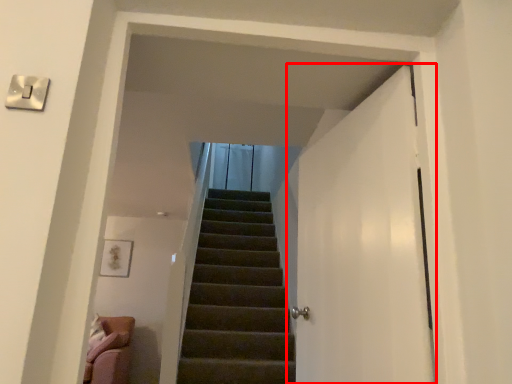
Question: In this image, where is door (annotated by the red box) located relative to electric outlet?

Choices:
 (A) right
 (B) left

Answer: (A)